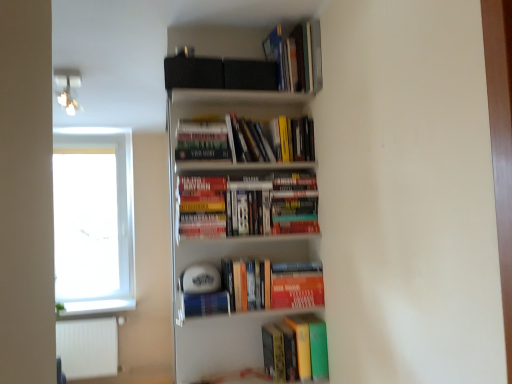
Question: Does white glass window at left have a lesser width compared to orange matte paperback book at center?

Choices:
 (A) yes
 (B) no

Answer: (B)

Question: Can you confirm if white glass window at left is smaller than orange matte paperback book at center?

Choices:
 (A) no
 (B) yes

Answer: (A)

Question: Is white glass window at left bigger than orange matte paperback book at center?

Choices:
 (A) no
 (B) yes

Answer: (B)

Question: Is white glass window at left far from orange matte paperback book at center?

Choices:
 (A) no
 (B) yes

Answer: (B)

Question: Is white glass window at left facing towards orange matte paperback book at center?

Choices:
 (A) no
 (B) yes

Answer: (A)

Question: In the image, is hardcover books at upper center, which ranks as the 3th book in bottom-to-top order, positioned in front of or behind white glossy bookshelf at upper center?

Choices:
 (A) front
 (B) behind

Answer: (B)

Question: In terms of width, does hardcover books at upper center, which ranks as the 3th book in bottom-to-top order, look wider or thinner when compared to white glossy bookshelf at upper center?

Choices:
 (A) wide
 (B) thin

Answer: (B)

Question: From a real-world perspective, is hardcover books at upper center, which ranks as the 3th book in bottom-to-top order, physically located above or below white glossy bookshelf at upper center?

Choices:
 (A) above
 (B) below

Answer: (A)

Question: From the image's perspective, relative to white glossy bookshelf at upper center, is hardcover books at upper center, which ranks as the 3th book in bottom-to-top order, above or below?

Choices:
 (A) above
 (B) below

Answer: (A)

Question: From a real-world perspective, is hardcover books at upper center, which ranks as the 3th book in bottom-to-top order, positioned above or below white glass window at left?

Choices:
 (A) below
 (B) above

Answer: (B)

Question: Does point (298, 130) appear closer or farther from the camera than point (118, 269)?

Choices:
 (A) farther
 (B) closer

Answer: (B)

Question: In terms of size, does hardcover books at upper center, which ranks as the 3th book in bottom-to-top order, appear bigger or smaller than white glass window at left?

Choices:
 (A) big
 (B) small

Answer: (B)

Question: Relative to white glass window at left, is hardcover books at upper center, which ranks as the 3th book in bottom-to-top order, in front or behind?

Choices:
 (A) behind
 (B) front

Answer: (B)

Question: In the image, is orange matte paperback book at center positioned in front of or behind white glossy bookshelf at upper center?

Choices:
 (A) behind
 (B) front

Answer: (A)

Question: Is orange matte paperback book at center taller or shorter than white glossy bookshelf at upper center?

Choices:
 (A) tall
 (B) short

Answer: (B)